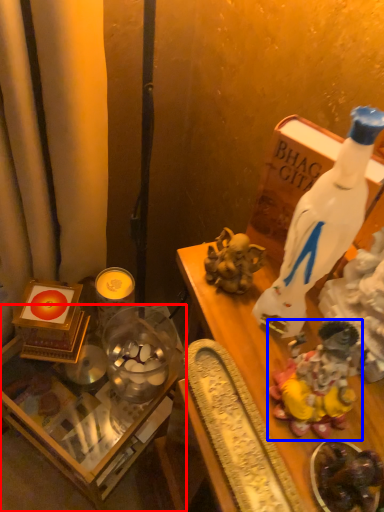
Question: Which of the following is the farthest to the observer, table (highlighted by a red box) or toy (highlighted by a blue box)?

Choices:
 (A) table
 (B) toy

Answer: (A)